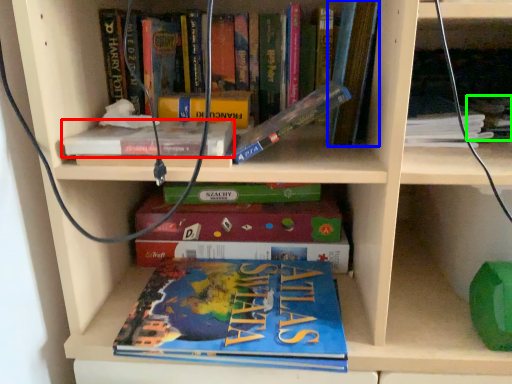
Question: Considering the real-world distances, which object is farthest from book (highlighted by a red box)? book (highlighted by a blue box) or book (highlighted by a green box)?

Choices:
 (A) book
 (B) book

Answer: (B)